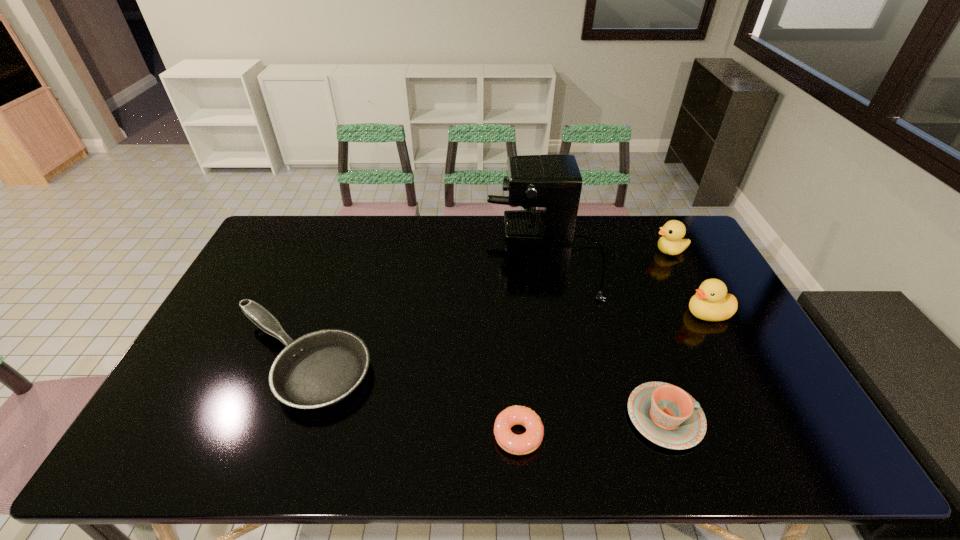
At what (x,y) coordinates should I click in order to perform the action: click on vacant space that is in between the doughnut and the chinaware. Please return your answer as a coordinate pair (x, y). Looking at the image, I should click on (591, 426).

At what (x,y) coordinates should I click in order to perform the action: click on free space between the nearer duck and the farther duck. Please return your answer as a coordinate pair (x, y). Image resolution: width=960 pixels, height=540 pixels. Looking at the image, I should click on (688, 282).

Find the location of a particular element. free space between the leftmost object and the nearer duck is located at coordinates (504, 338).

Find the location of a particular element. This screenshot has width=960, height=540. empty space between the tallest object and the chinaware is located at coordinates (605, 336).

This screenshot has width=960, height=540. In order to click on vacant space that's between the shortest object and the frying pan in this screenshot , I will do `click(409, 399)`.

This screenshot has width=960, height=540. In order to click on blank region between the frying pan and the nearer duck in this screenshot , I will do `click(504, 338)`.

Image resolution: width=960 pixels, height=540 pixels. What are the coordinates of `free space that is in between the tallest object and the leftmost object` in the screenshot? It's located at (422, 308).

You are a GUI agent. You are given a task and a screenshot of the screen. Output one action in this format:
    pyautogui.click(x=<x>, y=<y>)
    Task: Click on the free point between the nearer duck and the shortest object
    
    Given the screenshot: What is the action you would take?
    pyautogui.click(x=612, y=374)

Identify which object is the fourth nearest to the chinaware. Please provide its 2D coordinates. Your answer should be formatted as a tuple, i.e. [(x, y)], where the tuple contains the x and y coordinates of a point satisfying the conditions above.

[(671, 243)]

The height and width of the screenshot is (540, 960). What are the coordinates of `the third closest object to the farther duck` in the screenshot? It's located at (668, 416).